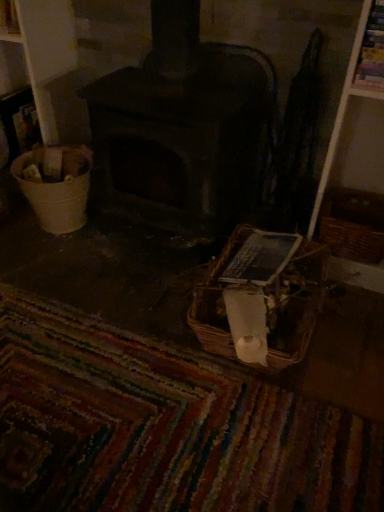
Question: Is multicolored woven mat at lower center wider than white plastic bucket at left?

Choices:
 (A) no
 (B) yes

Answer: (B)

Question: Can you confirm if multicolored woven mat at lower center is shorter than white plastic bucket at left?

Choices:
 (A) no
 (B) yes

Answer: (B)

Question: From the image's perspective, is multicolored woven mat at lower center on white plastic bucket at left?

Choices:
 (A) yes
 (B) no

Answer: (B)

Question: Would you say multicolored woven mat at lower center is a long distance from white plastic bucket at left?

Choices:
 (A) yes
 (B) no

Answer: (B)

Question: Considering the relative positions of multicolored woven mat at lower center and white plastic bucket at left in the image provided, is multicolored woven mat at lower center behind white plastic bucket at left?

Choices:
 (A) no
 (B) yes

Answer: (A)

Question: Is point (74, 202) closer or farther from the camera than point (175, 436)?

Choices:
 (A) farther
 (B) closer

Answer: (A)

Question: Do you think white plastic bucket at left is within multicolored woven mat at lower center, or outside of it?

Choices:
 (A) inside
 (B) outside

Answer: (B)

Question: From a real-world perspective, relative to multicolored woven mat at lower center, is white plastic bucket at left vertically above or below?

Choices:
 (A) below
 (B) above

Answer: (B)

Question: From the image's perspective, is white plastic bucket at left above or below multicolored woven mat at lower center?

Choices:
 (A) below
 (B) above

Answer: (B)

Question: Is point (28, 197) closer or farther from the camera than point (382, 250)?

Choices:
 (A) closer
 (B) farther

Answer: (B)

Question: Considering their positions, is white plastic bucket at left located in front of or behind brown woven basket at right, which appears as the second basket when viewed from the left?

Choices:
 (A) front
 (B) behind

Answer: (B)

Question: From the image's perspective, relative to brown woven basket at right, which appears as the second basket when viewed from the left, is white plastic bucket at left above or below?

Choices:
 (A) below
 (B) above

Answer: (B)

Question: Is white plastic bucket at left situated inside brown woven basket at right, which appears as the second basket when viewed from the left, or outside?

Choices:
 (A) inside
 (B) outside

Answer: (B)

Question: Is dark gray stone wood burning stove at center bigger or smaller than multicolored woven mat at lower center?

Choices:
 (A) small
 (B) big

Answer: (A)

Question: Looking at their shapes, would you say dark gray stone wood burning stove at center is wider or thinner than multicolored woven mat at lower center?

Choices:
 (A) thin
 (B) wide

Answer: (A)